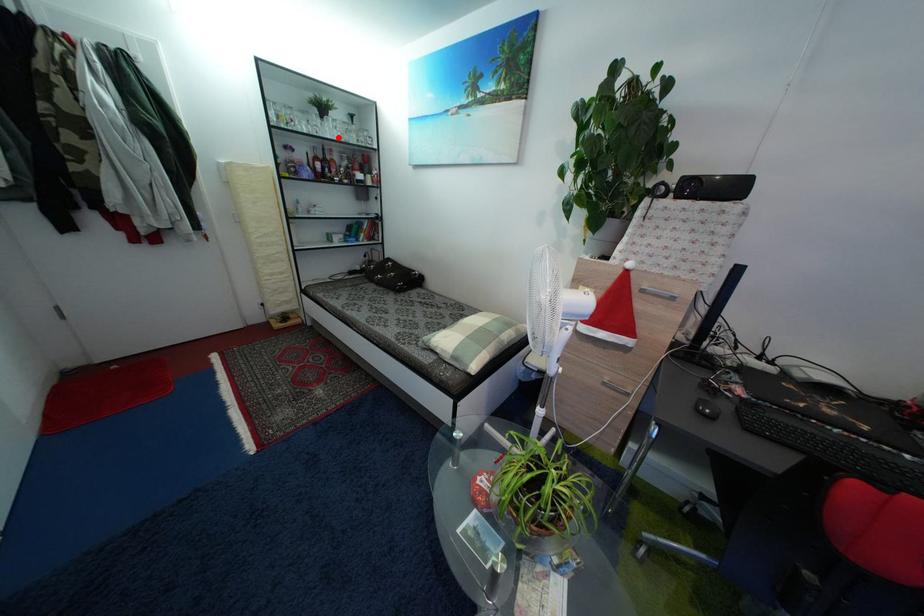
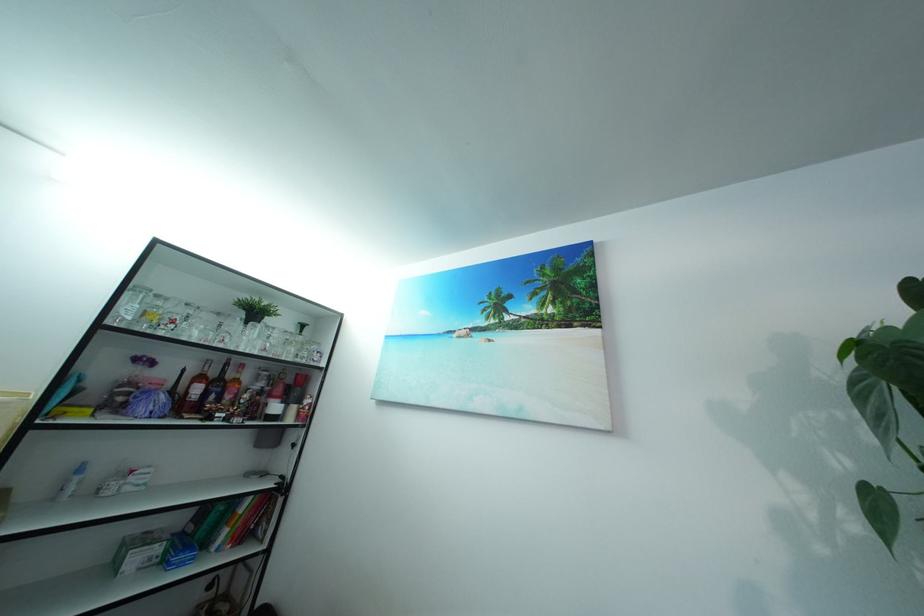
Locate, in the second image, the point that corresponds to the highlighted location in the first image.

(257, 347)